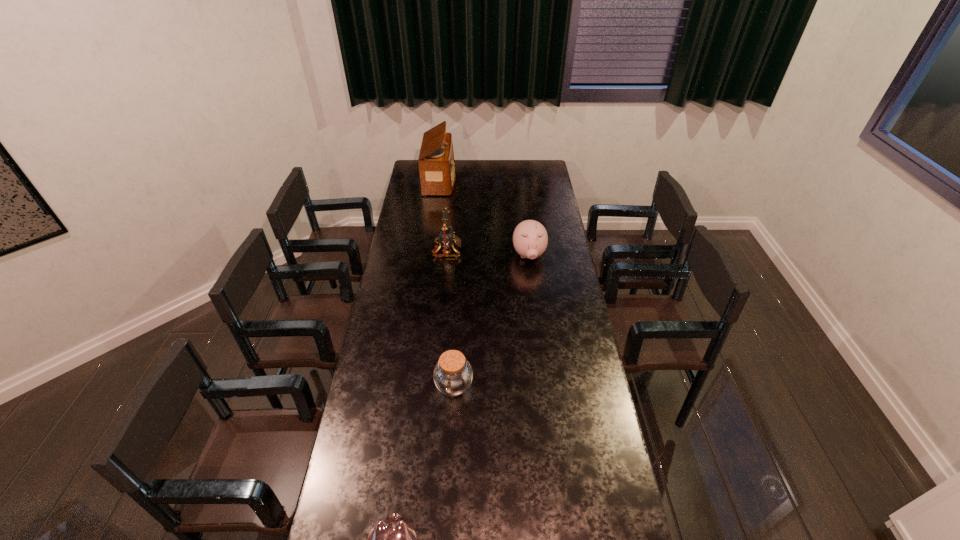
Where is `the tallest object`? This screenshot has width=960, height=540. the tallest object is located at coordinates (436, 163).

Identify the location of the farthest object. The image size is (960, 540). (436, 163).

Identify the location of the second tallest object. (446, 238).

Where is `the right piggy bank`? the right piggy bank is located at coordinates (530, 239).

Find the location of a particular element. Image resolution: width=960 pixels, height=540 pixels. the rightmost object is located at coordinates (530, 239).

Where is `jar`? jar is located at coordinates (453, 374).

Find the location of a particular element. The image size is (960, 540). vacant region located on the front panel of the farthest object is located at coordinates (513, 180).

Identify the location of free space located 0.090m on the front of the telephone, featuring the rotary dial. (479, 251).

The image size is (960, 540). Find the location of `vacant space located 0.130m at the snout of the farther piggy bank`. vacant space located 0.130m at the snout of the farther piggy bank is located at coordinates (533, 289).

What are the coordinates of `blank space located on the left of the fourth farthest object` in the screenshot? It's located at (372, 386).